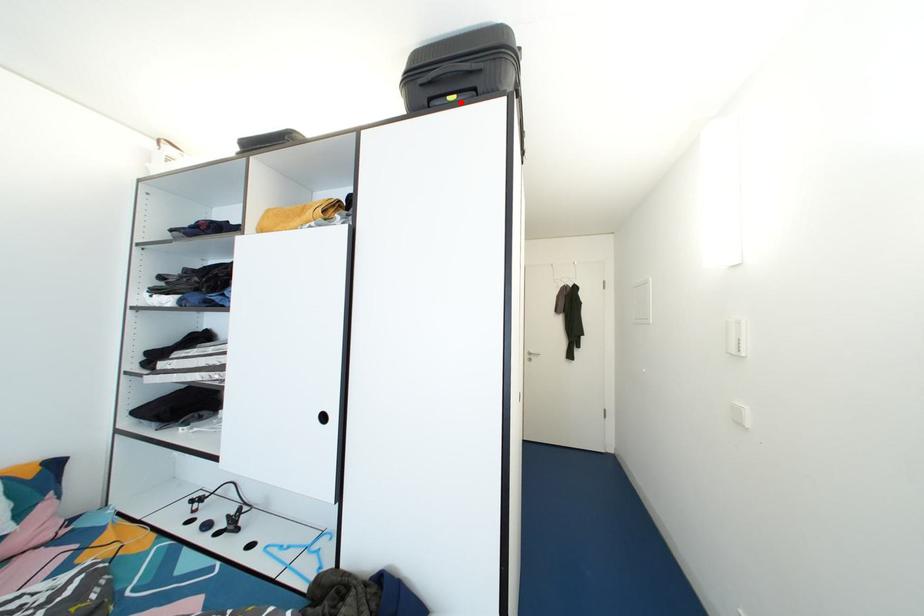
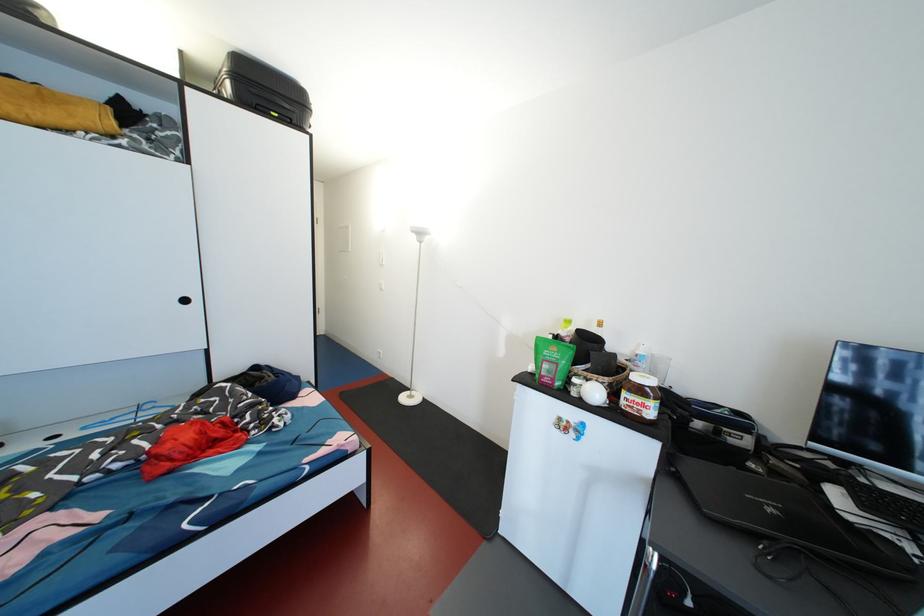
In the second image, find the point that corresponds to the highlighted location in the first image.

(283, 120)